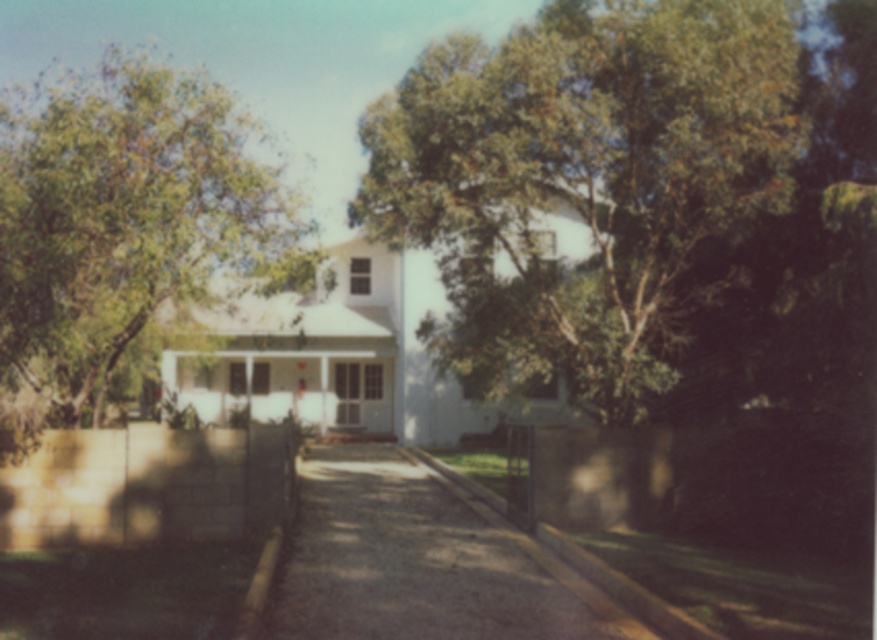
Question: Can you confirm if green leafy tree at upper left is positioned above gravelly asphalt driveway at center?

Choices:
 (A) no
 (B) yes

Answer: (B)

Question: Among these objects, which one is nearest to the camera?

Choices:
 (A) gravelly asphalt driveway at center
 (B) green leafy tree at upper center
 (C) green leafy tree at upper left

Answer: (A)

Question: Is green leafy tree at upper center below gravelly asphalt driveway at center?

Choices:
 (A) no
 (B) yes

Answer: (A)

Question: Which object is positioned farthest from the gravelly asphalt driveway at center?

Choices:
 (A) green leafy tree at upper center
 (B) green leafy tree at upper left

Answer: (B)

Question: Is green leafy tree at upper left positioned before gravelly asphalt driveway at center?

Choices:
 (A) yes
 (B) no

Answer: (B)

Question: Which point appears closest to the camera in this image?

Choices:
 (A) (317, 470)
 (B) (589, 156)
 (C) (150, 257)

Answer: (C)